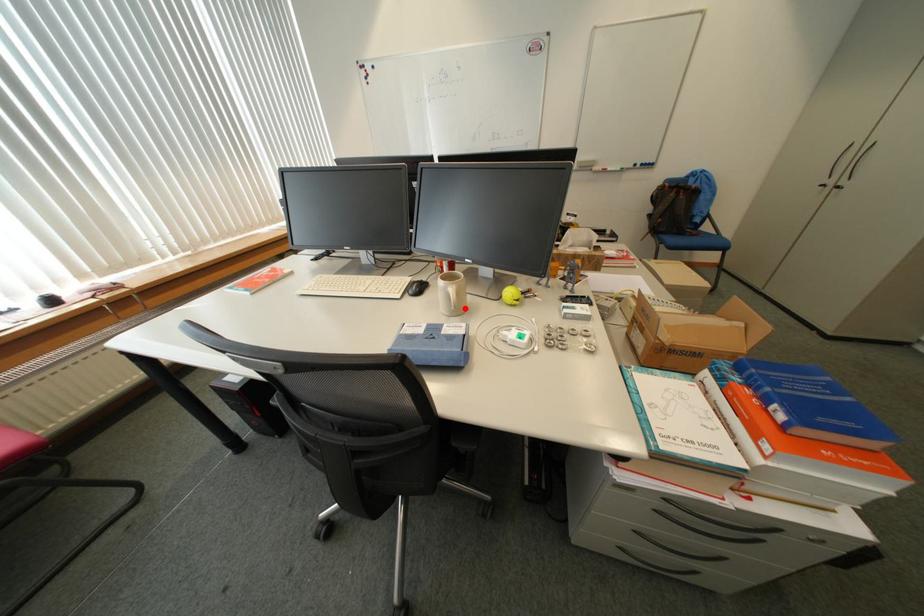
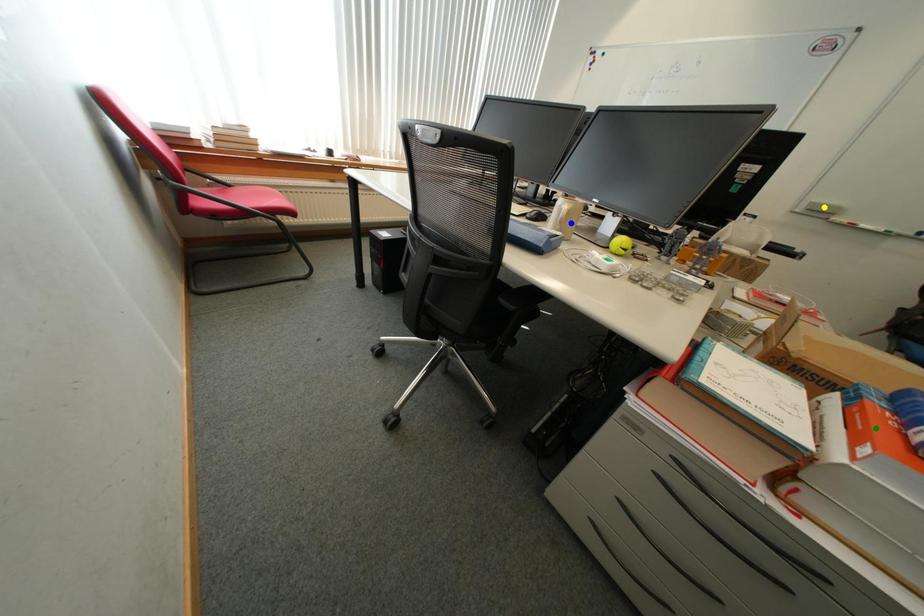
Question: I am providing you with two images of the same scene from different viewpoints. A red point is marked on the first image. You are given multiple points on the second image. Can you choose the point in image 2 that corresponds to the point in image 1?

Choices:
 (A) blue point
 (B) yellow point
 (C) green point

Answer: (A)